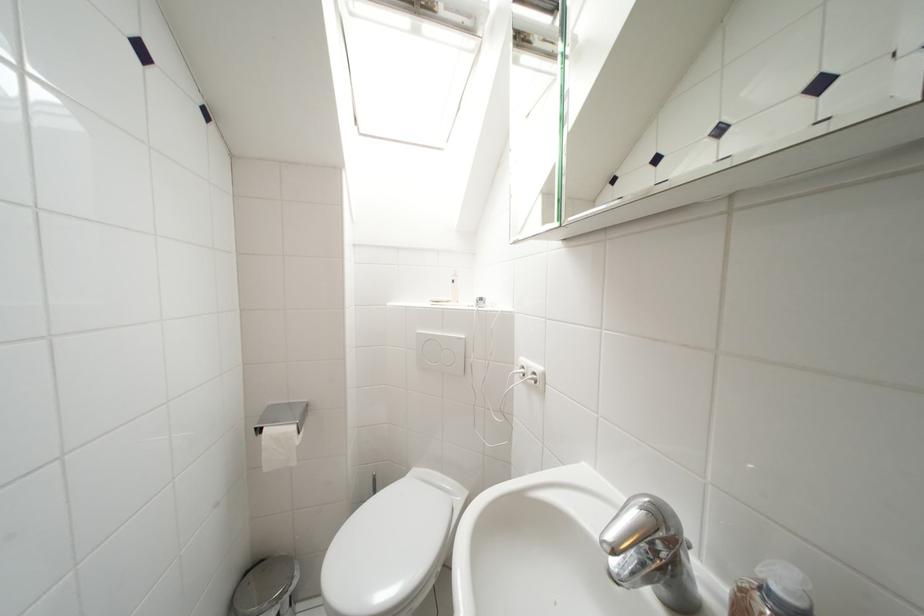
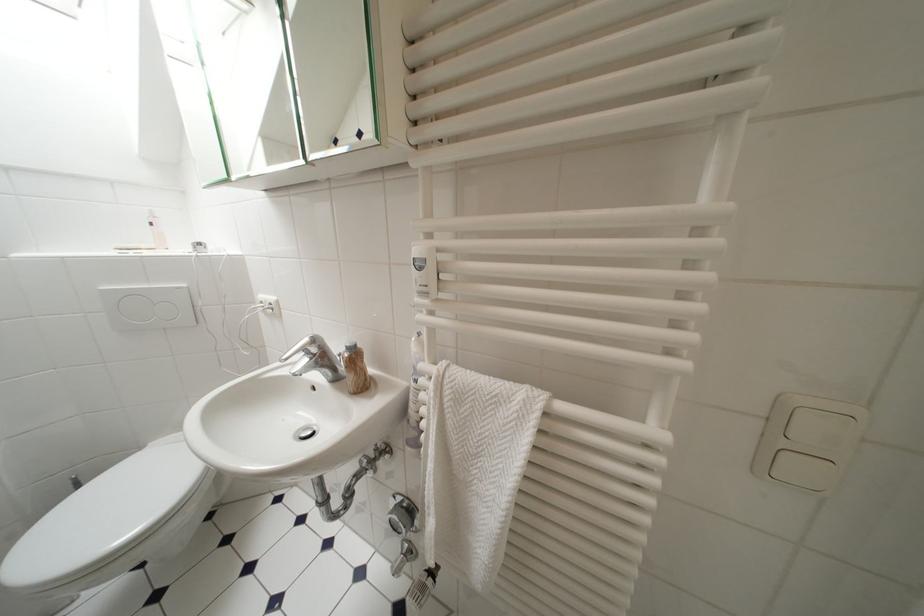
The point at (459, 285) is marked in the first image. Where is the corresponding point in the second image?

(159, 227)